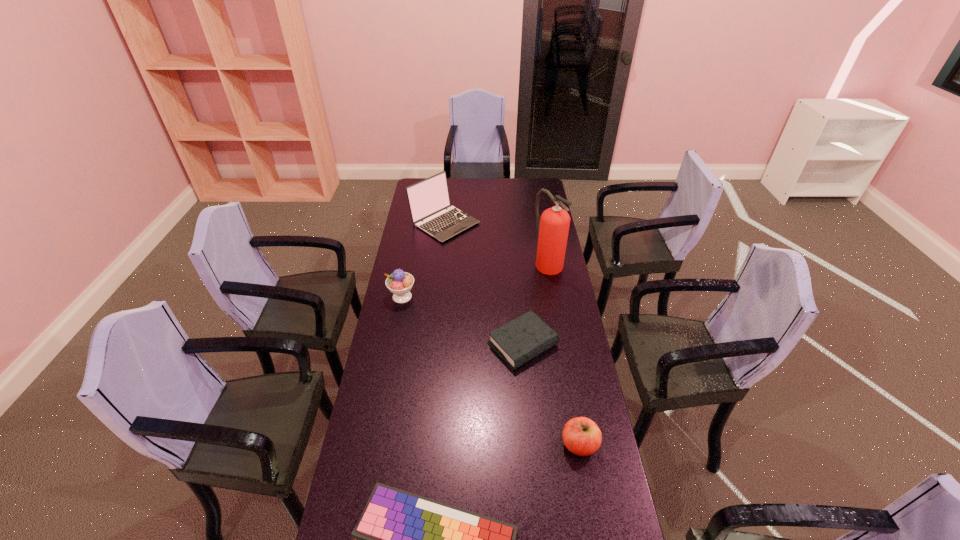
Where is `the fifth nearest object`? The image size is (960, 540). the fifth nearest object is located at coordinates (553, 227).

The image size is (960, 540). Identify the location of fire extinguisher. (553, 227).

At what (x,y) coordinates should I click in order to perform the action: click on laptop_computer. Please return your answer as a coordinate pair (x, y). Image resolution: width=960 pixels, height=540 pixels. Looking at the image, I should click on (428, 199).

Locate an element on the screen. the farthest object is located at coordinates (428, 199).

Identify the location of icecream. (400, 283).

Locate an element on the screen. The height and width of the screenshot is (540, 960). the fourth nearest object is located at coordinates (400, 283).

At what (x,y) coordinates should I click in order to perform the action: click on the third shortest object. Please return your answer as a coordinate pair (x, y). This screenshot has width=960, height=540. Looking at the image, I should click on (581, 436).

At what (x,y) coordinates should I click in order to perform the action: click on apple. Please return your answer as a coordinate pair (x, y). Image resolution: width=960 pixels, height=540 pixels. Looking at the image, I should click on 581,436.

Where is `the fourth farthest object`? The height and width of the screenshot is (540, 960). the fourth farthest object is located at coordinates (520, 340).

This screenshot has width=960, height=540. I want to click on the fifth tallest object, so click(520, 340).